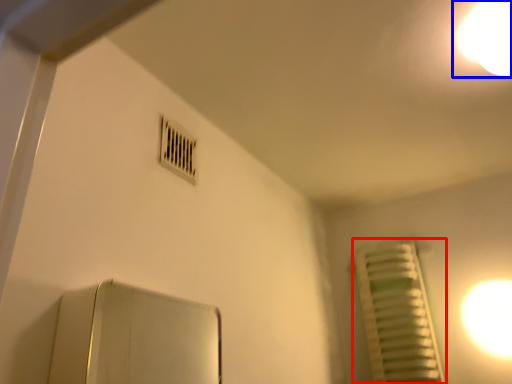
Question: Among these objects, which one is farthest to the camera, radiator (highlighted by a red box) or light (highlighted by a blue box)?

Choices:
 (A) radiator
 (B) light

Answer: (A)